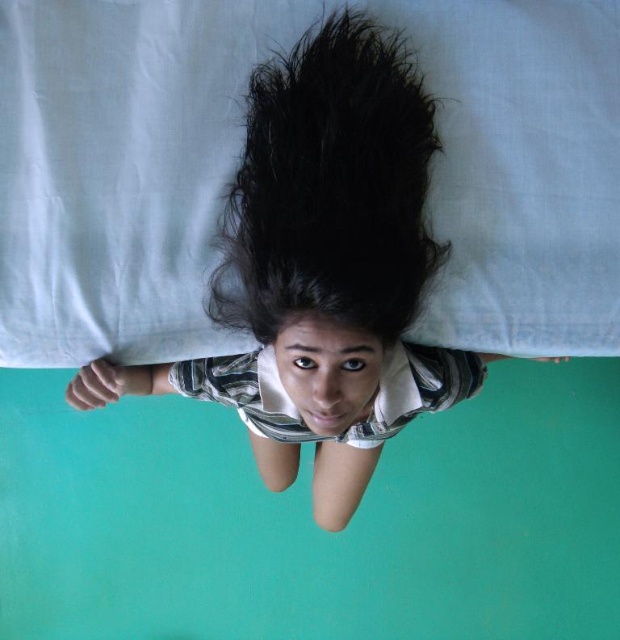
Between smooth black hair at center and black matte hair at center, which one is positioned lower?

smooth black hair at center is below.

Is smooth black hair at center above black matte hair at center?

No.

Describe the element at coordinates (321, 269) in the screenshot. I see `smooth black hair at center` at that location.

The image size is (620, 640). Identify the location of smooth black hair at center. (321, 269).